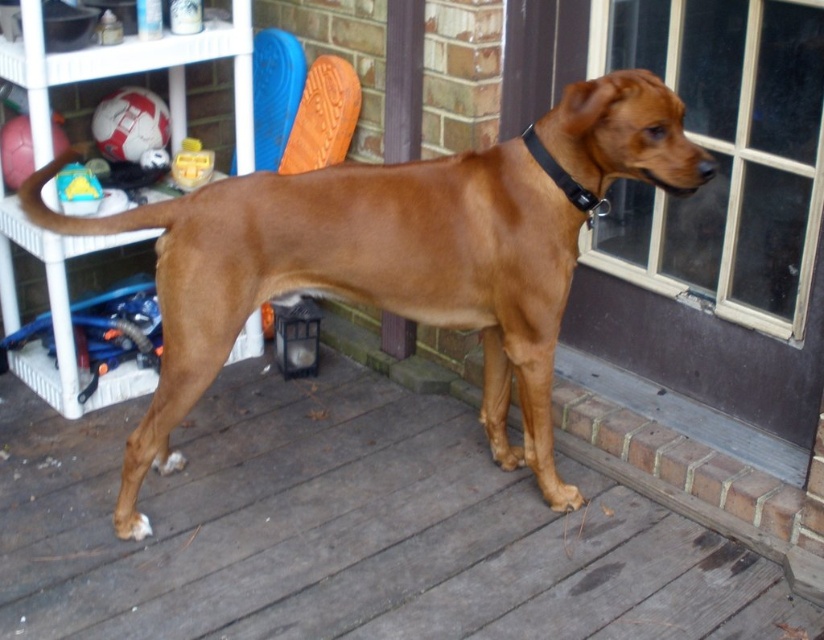
Which of these two, transparent glass door at upper right or black leather collar at upper center, stands taller?

Standing taller between the two is transparent glass door at upper right.

Does transparent glass door at upper right have a lesser height compared to black leather collar at upper center?

Incorrect, transparent glass door at upper right's height does not fall short of black leather collar at upper center's.

Between point (803, 173) and point (556, 172), which one is positioned in front?

Point (556, 172) is more forward.

In order to click on transparent glass door at upper right in this screenshot , I will do `click(723, 154)`.

Can you confirm if brown shiny dog at center is bigger than black leather collar at upper center?

Correct, brown shiny dog at center is larger in size than black leather collar at upper center.

What do you see at coordinates (356, 280) in the screenshot? I see `brown shiny dog at center` at bounding box center [356, 280].

Between point (648, 156) and point (570, 202), which one is positioned in front?

Point (648, 156) is more forward.

You are a GUI agent. You are given a task and a screenshot of the screen. Output one action in this format:
    pyautogui.click(x=<x>, y=<y>)
    Task: Click on the brown shiny dog at center
    This screenshot has width=824, height=640.
    Given the screenshot: What is the action you would take?
    pyautogui.click(x=356, y=280)

Does brown wooden deck at center have a larger size compared to black leather collar at upper center?

Yes, brown wooden deck at center is bigger than black leather collar at upper center.

Where is `brown wooden deck at center`? Image resolution: width=824 pixels, height=640 pixels. brown wooden deck at center is located at coordinates (349, 531).

Identify the location of brown wooden deck at center. The width and height of the screenshot is (824, 640). (349, 531).